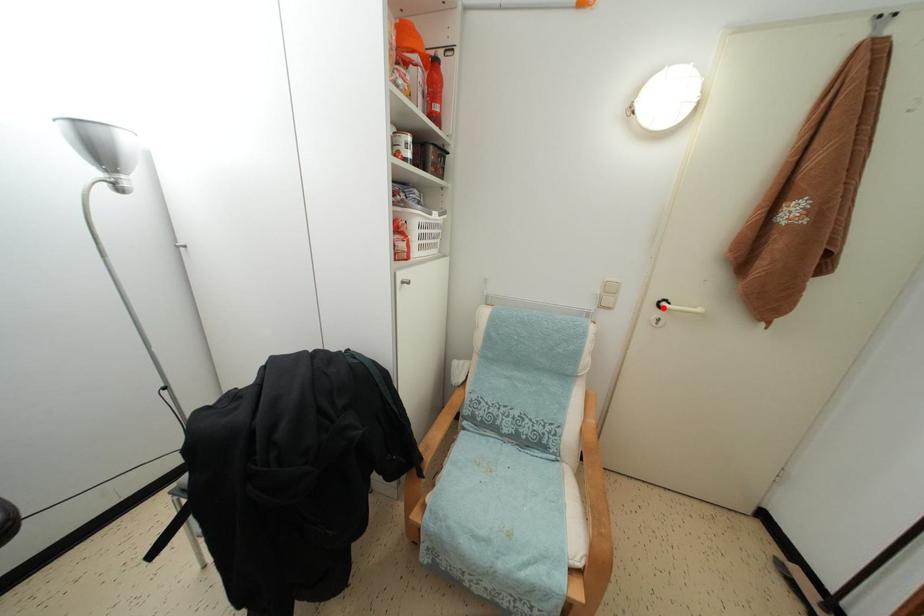
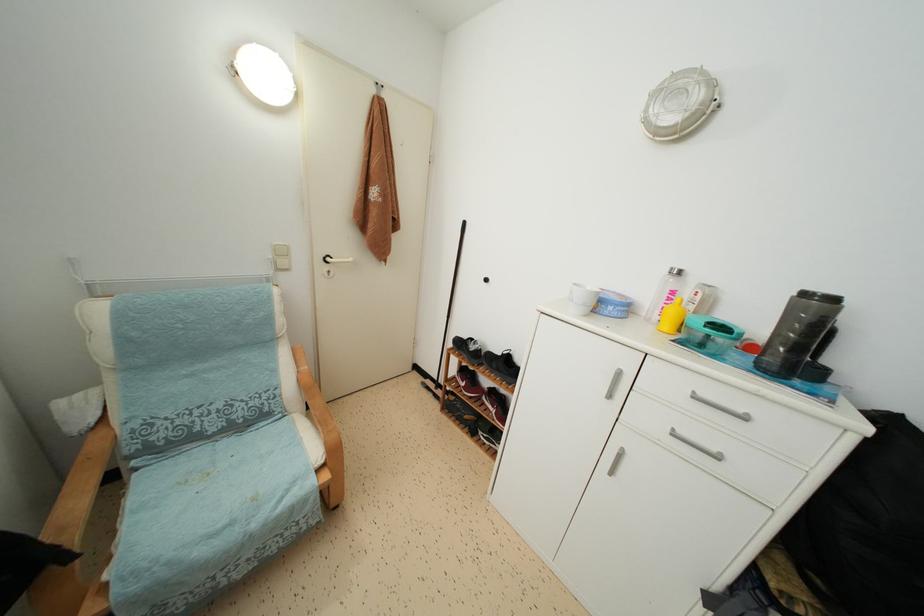
Locate, in the second image, the point that corresponds to the highlighted location in the first image.

(329, 264)